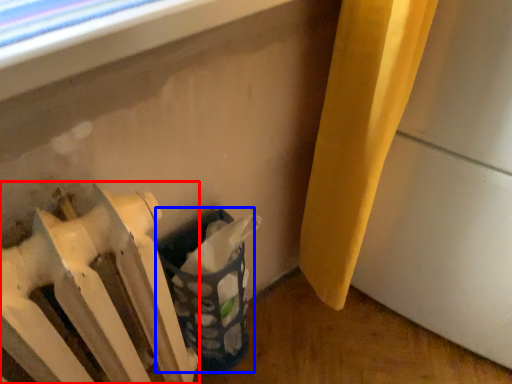
Question: Which of the following is the closest to the observer, radiator (highlighted by a red box) or laundry basket (highlighted by a blue box)?

Choices:
 (A) radiator
 (B) laundry basket

Answer: (A)